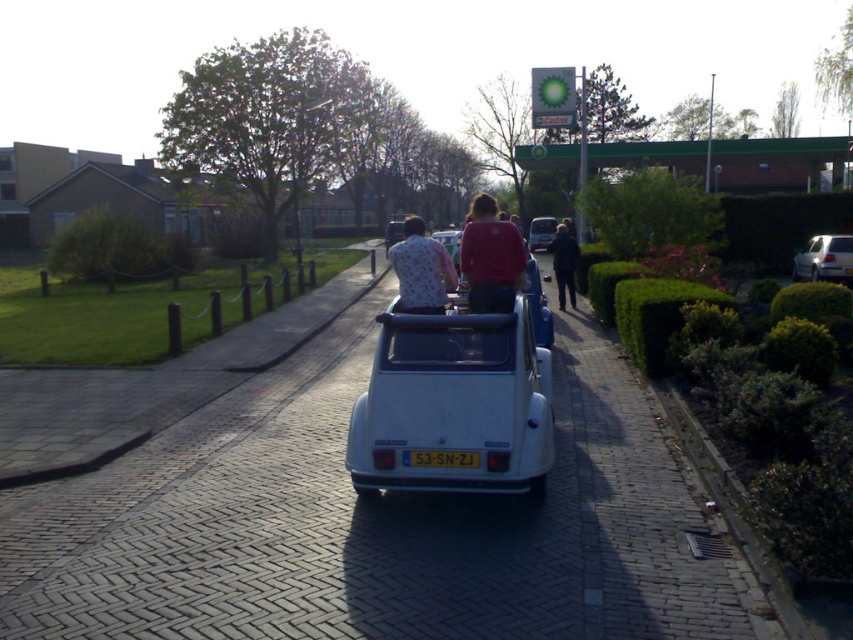
Question: Estimate the real-world distances between objects in this image. Which object is closer to the white patterned shirt at center?

Choices:
 (A) matte white car at center
 (B) dark blue jeans at center
 (C) yellow matte license plate at center

Answer: (C)

Question: Is white patterned shirt at center thinner than silver metallic hatchback at right?

Choices:
 (A) yes
 (B) no

Answer: (B)

Question: Can you confirm if white patterned shirt at center is positioned below yellow matte license plate at center?

Choices:
 (A) no
 (B) yes

Answer: (A)

Question: Among these objects, which one is nearest to the camera?

Choices:
 (A) matte red shirt at center
 (B) white patterned shirt at center
 (C) white matte car at center

Answer: (B)

Question: Which point is farther to the camera?

Choices:
 (A) white patterned shirt at center
 (B) yellow matte license plate at center
 (C) dark blue jeans at center

Answer: (C)

Question: Is matte red shirt at center to the right of white matte car at center from the viewer's perspective?

Choices:
 (A) yes
 (B) no

Answer: (A)